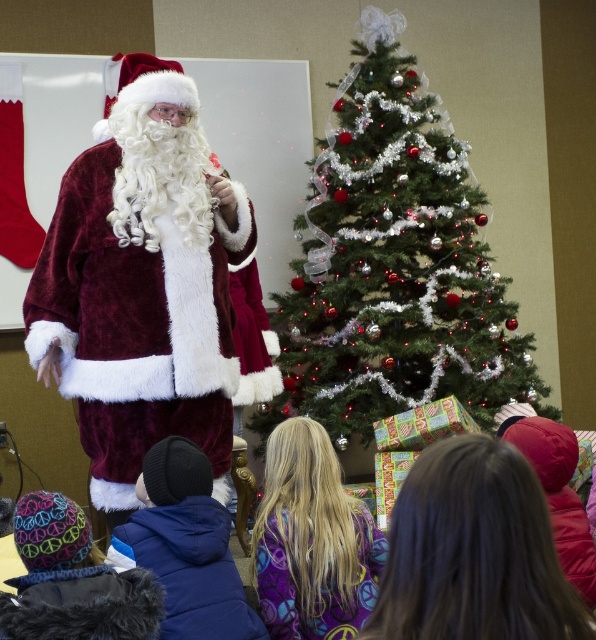
You are a photographer trying to capture a photo of the shiny silver christmas tree at center and the velvet maroon santa at left. Based on their positions, which one is closer to the camera?

The shiny silver christmas tree at center is positioned over the velvet maroon santa at left, meaning it is closer to the camera.

You are a photographer planning to take a photo of the velvet maroon santa at left and the purple fleece sweatshirt at lower center. To ensure both are in focus, you need to know their vertical positions. Which one is higher in the image?

The velvet maroon santa at left is located above the purple fleece sweatshirt at lower center, so the velvet maroon santa at left is higher in the image.